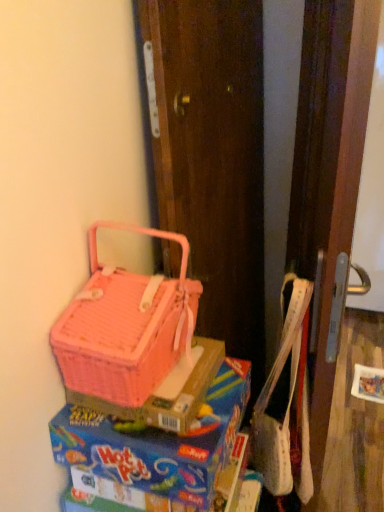
Question: From a real-world perspective, is pink wicker picnic basket at left on pink wicker basket at upper left?

Choices:
 (A) no
 (B) yes

Answer: (B)

Question: Can we say pink wicker picnic basket at left lies outside pink wicker basket at upper left?

Choices:
 (A) yes
 (B) no

Answer: (A)

Question: Can you confirm if pink wicker picnic basket at left is taller than pink wicker basket at upper left?

Choices:
 (A) yes
 (B) no

Answer: (A)

Question: From the image's perspective, is pink wicker picnic basket at left under pink wicker basket at upper left?

Choices:
 (A) yes
 (B) no

Answer: (B)

Question: Considering the relative sizes of pink wicker picnic basket at left and pink wicker basket at upper left in the image provided, is pink wicker picnic basket at left wider than pink wicker basket at upper left?

Choices:
 (A) no
 (B) yes

Answer: (A)

Question: Considering the relative positions of pink wicker picnic basket at left and pink wicker basket at upper left in the image provided, is pink wicker picnic basket at left to the left of pink wicker basket at upper left from the viewer's perspective?

Choices:
 (A) yes
 (B) no

Answer: (A)

Question: Is wooden screen door at right positioned far away from pink wicker picnic basket at left?

Choices:
 (A) yes
 (B) no

Answer: (B)

Question: Are wooden screen door at right and pink wicker picnic basket at left making contact?

Choices:
 (A) yes
 (B) no

Answer: (B)

Question: Can you confirm if wooden screen door at right is taller than pink wicker picnic basket at left?

Choices:
 (A) no
 (B) yes

Answer: (B)

Question: Is wooden screen door at right smaller than pink wicker picnic basket at left?

Choices:
 (A) no
 (B) yes

Answer: (A)

Question: Can you confirm if wooden screen door at right is positioned to the left of pink wicker picnic basket at left?

Choices:
 (A) yes
 (B) no

Answer: (B)

Question: Is wooden screen door at right positioned with its back to pink wicker picnic basket at left?

Choices:
 (A) yes
 (B) no

Answer: (B)

Question: Is pink plastic lunch box at lower left looking in the opposite direction of wooden screen door at right?

Choices:
 (A) no
 (B) yes

Answer: (A)